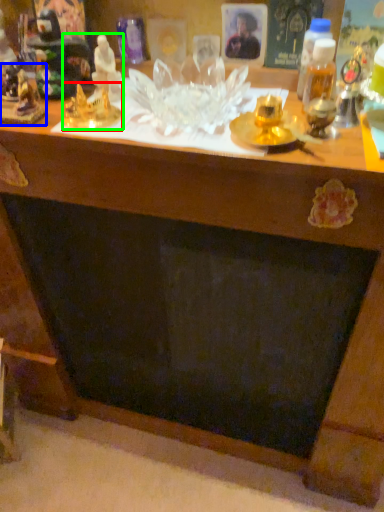
Question: Which is nearer to the toy (highlighted by a red box)? toy (highlighted by a blue box) or toy (highlighted by a green box).

Choices:
 (A) toy
 (B) toy

Answer: (B)